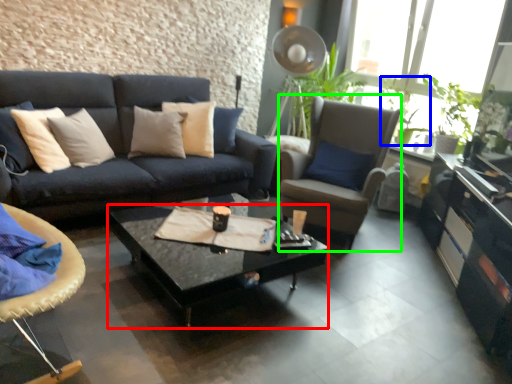
Question: Estimate the real-world distances between objects in this image. Which object is closer to coffee table (highlighted by a red box), houseplant (highlighted by a blue box) or chair (highlighted by a green box)?

Choices:
 (A) houseplant
 (B) chair

Answer: (B)